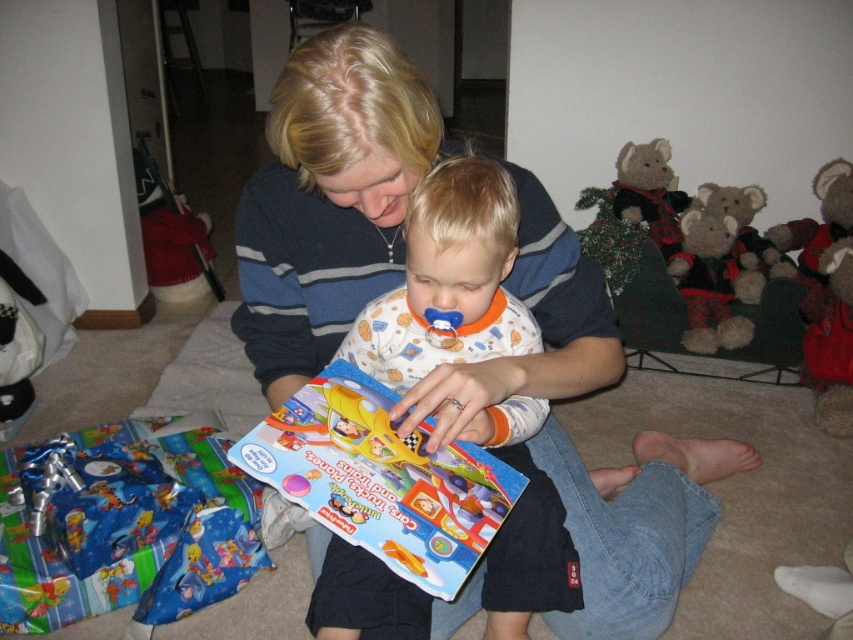
Looking at this image, you are a photographer positioned at the origin point in the room. You want to take a photo of the white cotton onesie at center. What are the coordinates where you should aim your camera to capture it?

The white cotton onesie at center is located at coordinates point (448, 280), so you should aim your camera at those coordinates to capture it.